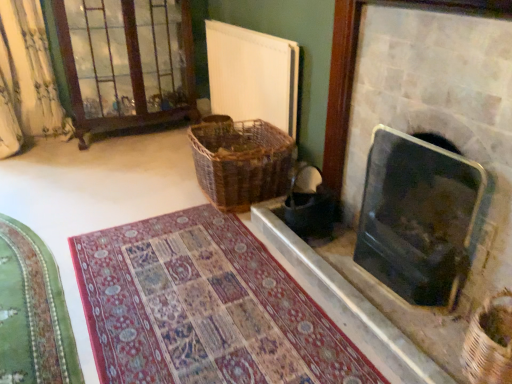
Question: Is woven brown basket at lower right, which is the 1th basket from right to left, oriented towards woven brown basket at center, arranged as the first basket when viewed from the top?

Choices:
 (A) no
 (B) yes

Answer: (A)

Question: Is woven brown basket at lower right, positioned as the first basket in bottom-to-top order, positioned in front of woven brown basket at center, which is counted as the second basket, starting from the bottom?

Choices:
 (A) yes
 (B) no

Answer: (A)

Question: Is woven brown basket at lower right, which is the 1th basket from right to left, positioned with its back to woven brown basket at center, positioned as the 1th basket in back-to-front order?

Choices:
 (A) yes
 (B) no

Answer: (B)

Question: From a real-world perspective, is woven brown basket at lower right, placed as the second basket when sorted from top to bottom, located beneath woven brown basket at center, which is the 2th basket in front-to-back order?

Choices:
 (A) no
 (B) yes

Answer: (B)

Question: Is woven brown basket at lower right, arranged as the 2th basket when viewed from the back, to the left of woven brown basket at center, the first basket in the left-to-right sequence, from the viewer's perspective?

Choices:
 (A) no
 (B) yes

Answer: (A)

Question: Is woven brown basket at lower right, positioned as the first basket in bottom-to-top order, wider or thinner than brown wooden glass door at upper left?

Choices:
 (A) thin
 (B) wide

Answer: (A)

Question: From a real-world perspective, is woven brown basket at lower right, which is the 1th basket from right to left, physically located above or below brown wooden glass door at upper left?

Choices:
 (A) above
 (B) below

Answer: (B)

Question: From the image's perspective, relative to brown wooden glass door at upper left, is woven brown basket at lower right, placed as the second basket when sorted from top to bottom, above or below?

Choices:
 (A) below
 (B) above

Answer: (A)

Question: In terms of height, does woven brown basket at lower right, arranged as the 2th basket when viewed from the back, look taller or shorter compared to brown wooden glass door at upper left?

Choices:
 (A) tall
 (B) short

Answer: (B)

Question: Do you think green velvet mat at lower left, the 2th mat when ordered from right to left, is within brown wooden glass door at upper left, or outside of it?

Choices:
 (A) inside
 (B) outside

Answer: (B)

Question: Is point (33, 241) positioned closer to the camera than point (133, 104)?

Choices:
 (A) farther
 (B) closer

Answer: (B)

Question: Looking at their shapes, would you say green velvet mat at lower left, positioned as the first mat in left-to-right order, is wider or thinner than brown wooden glass door at upper left?

Choices:
 (A) thin
 (B) wide

Answer: (A)

Question: Considering the relative positions of green velvet mat at lower left, the 2th mat when ordered from right to left, and brown wooden glass door at upper left in the image provided, is green velvet mat at lower left, the 2th mat when ordered from right to left, to the left or to the right of brown wooden glass door at upper left?

Choices:
 (A) left
 (B) right

Answer: (A)

Question: From the image's perspective, is black glass fireplace at right, which is the first fireplace from bottom to top, above or below woven brown basket at lower right, placed as the second basket when sorted from top to bottom?

Choices:
 (A) above
 (B) below

Answer: (A)

Question: Considering the positions of black glass fireplace at right, marked as the second fireplace in a top-to-bottom arrangement, and woven brown basket at lower right, arranged as the 2th basket when viewed from the back, in the image, is black glass fireplace at right, marked as the second fireplace in a top-to-bottom arrangement, bigger or smaller than woven brown basket at lower right, arranged as the 2th basket when viewed from the back,?

Choices:
 (A) small
 (B) big

Answer: (B)